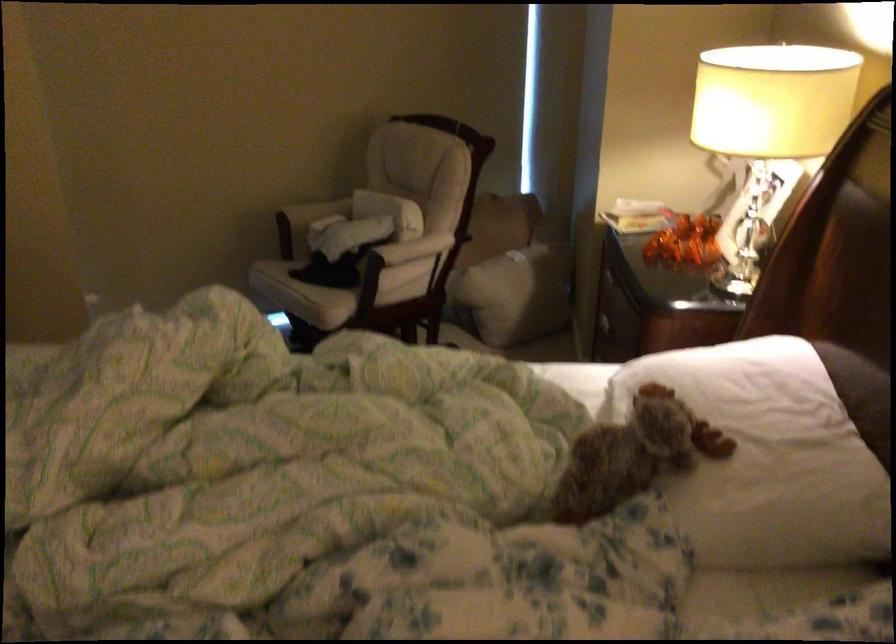
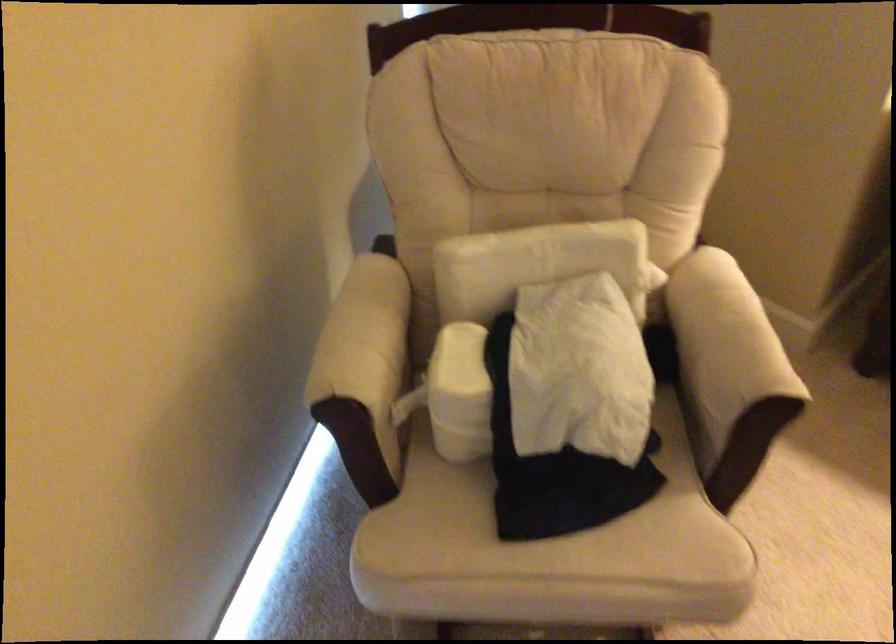
The point at (297,207) is marked in the first image. Where is the corresponding point in the second image?

(364, 373)